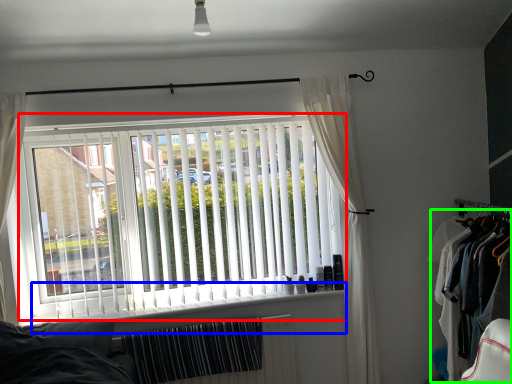
Question: Which is nearer to the window blind (highlighted by a red box)? window sill (highlighted by a blue box) or clothing (highlighted by a green box).

Choices:
 (A) window sill
 (B) clothing

Answer: (A)